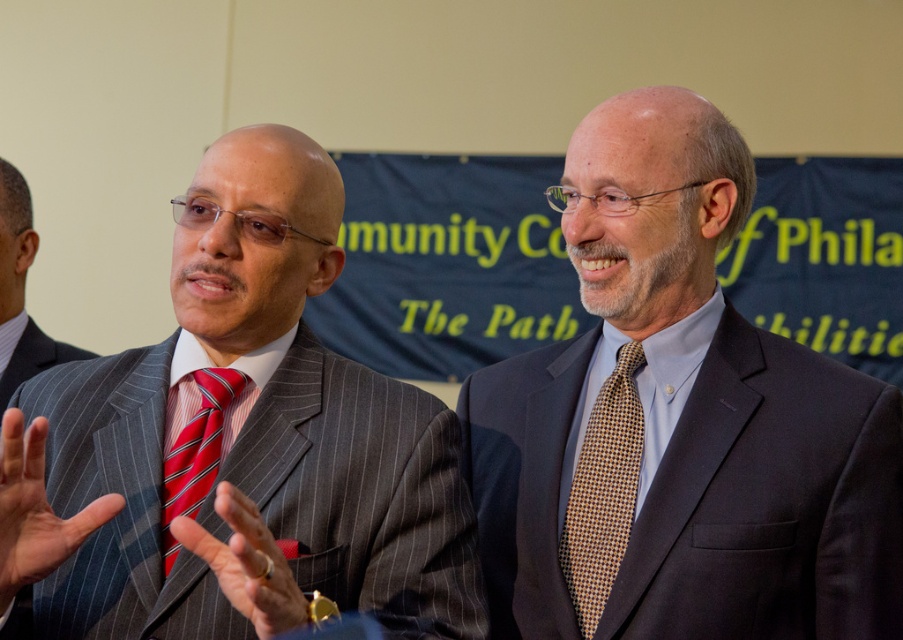
Is brown checkered tie at right wider than skinny red tie at left?

In fact, brown checkered tie at right might be narrower than skinny red tie at left.

Between point (566, 544) and point (14, 536), which one is positioned in front?

Point (14, 536)

This screenshot has width=903, height=640. In order to click on brown checkered tie at right in this screenshot , I will do `click(603, 492)`.

Is gray pinstripe suit at center bigger than pinstriped suit at left?

Correct, gray pinstripe suit at center is larger in size than pinstriped suit at left.

Is gray pinstripe suit at center smaller than pinstriped suit at left?

No.

Between point (247, 468) and point (31, 250), which one is positioned behind?

The point (31, 250) is more distant.

Where is `gray pinstripe suit at center`? The image size is (903, 640). gray pinstripe suit at center is located at coordinates (236, 444).

Is the position of brown checkered tie at right less distant than that of matte silver ring at center?

No, it is not.

Consider the image. Can you confirm if brown checkered tie at right is wider than matte silver ring at center?

No, brown checkered tie at right is not wider than matte silver ring at center.

Describe the element at coordinates (603, 492) in the screenshot. I see `brown checkered tie at right` at that location.

Identify the location of brown checkered tie at right. The width and height of the screenshot is (903, 640). (603, 492).